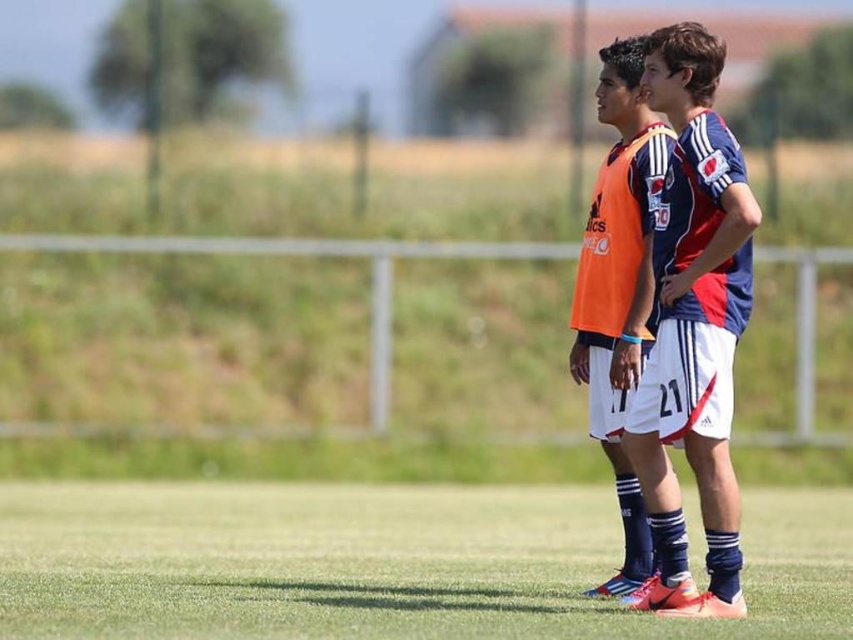
Question: Is green turf at lower center closer to camera compared to blue jersey at center?

Choices:
 (A) yes
 (B) no

Answer: (A)

Question: Which object is closer to the camera taking this photo?

Choices:
 (A) green turf at lower center
 (B) orange jersey at center

Answer: (A)

Question: Which point is closer to the camera taking this photo?

Choices:
 (A) (643, 310)
 (B) (338, 502)

Answer: (A)

Question: Does green turf at lower center appear under orange jersey at center?

Choices:
 (A) no
 (B) yes

Answer: (B)

Question: Which of these objects is positioned closest to the orange jersey at center?

Choices:
 (A) green turf at lower center
 (B) blue jersey at center

Answer: (B)

Question: Does green turf at lower center lie in front of orange jersey at center?

Choices:
 (A) no
 (B) yes

Answer: (B)